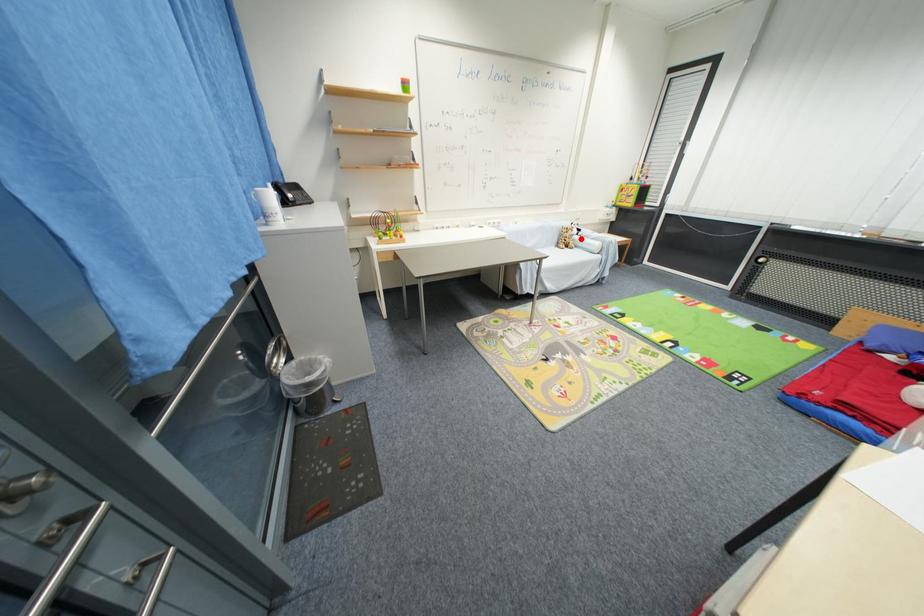
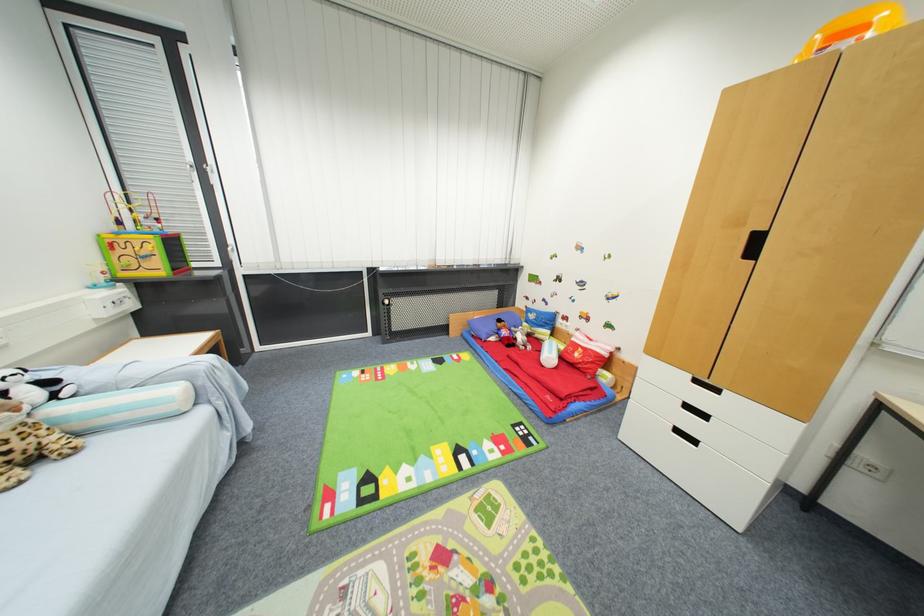
Question: I am providing you with two images of the same scene from different viewpoints. Image1 has a red point marked. In image2, the corresponding 3D location appears at what relative position? Reply with the corresponding letter.

Choices:
 (A) Closer
 (B) Farther

Answer: (B)